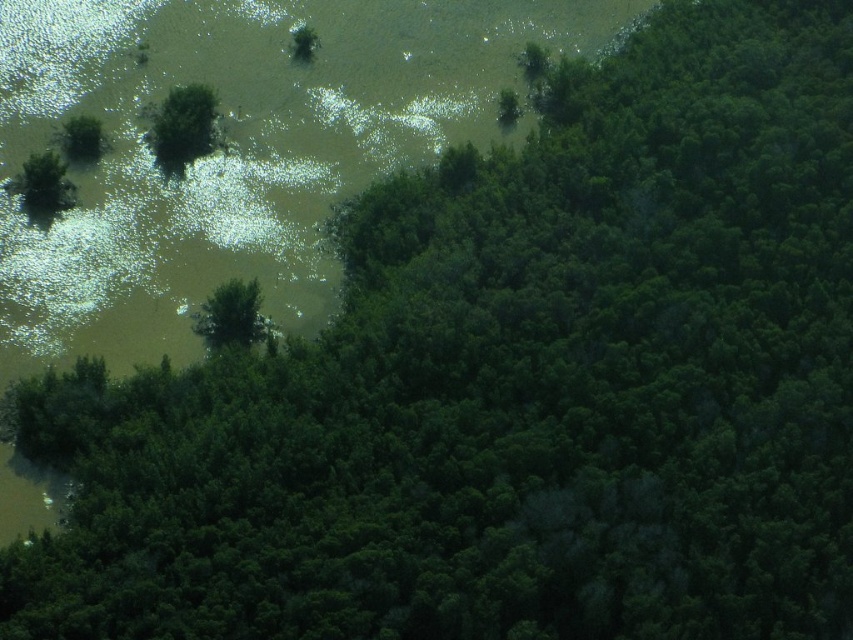
Question: Does green matte tree at upper left have a smaller size compared to green matte tree at center?

Choices:
 (A) no
 (B) yes

Answer: (A)

Question: Among these objects, which one is farthest from the camera?

Choices:
 (A) green matte tree at upper left
 (B) green matte tree at center

Answer: (A)

Question: Is green matte tree at upper left positioned behind green matte tree at center?

Choices:
 (A) yes
 (B) no

Answer: (A)

Question: Does green matte tree at upper left have a greater width compared to green matte tree at center?

Choices:
 (A) yes
 (B) no

Answer: (B)

Question: Among these objects, which one is farthest from the camera?

Choices:
 (A) green matte tree at upper left
 (B) green matte tree at center

Answer: (A)